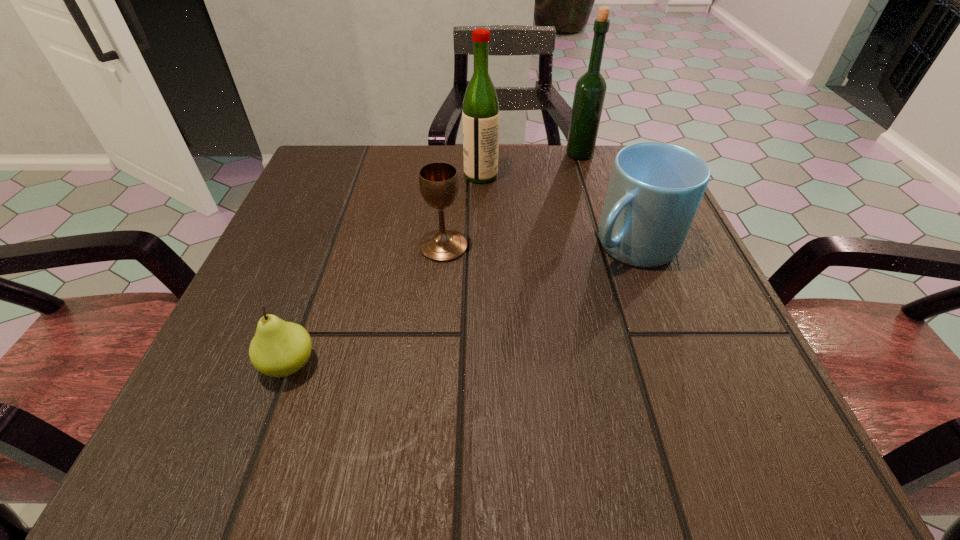
Locate an element on the screen. vacant space that is in between the fourth nearest object and the mug is located at coordinates click(556, 211).

At what (x,y) coordinates should I click in order to perform the action: click on free spot between the left liquor and the chalice. Please return your answer as a coordinate pair (x, y). The width and height of the screenshot is (960, 540). Looking at the image, I should click on (462, 211).

Where is `vacant region between the chalice and the right liquor`? vacant region between the chalice and the right liquor is located at coordinates (512, 200).

You are a GUI agent. You are given a task and a screenshot of the screen. Output one action in this format:
    pyautogui.click(x=<x>, y=<y>)
    Task: Click on the free space between the mug and the leftmost object
    This screenshot has height=540, width=960.
    Given the screenshot: What is the action you would take?
    pyautogui.click(x=461, y=305)

Locate an element on the screen. The width and height of the screenshot is (960, 540). vacant space in between the chalice and the nearer liquor is located at coordinates (462, 211).

Locate an element on the screen. The width and height of the screenshot is (960, 540). object that is the third closest to the mug is located at coordinates (438, 181).

You are a GUI agent. You are given a task and a screenshot of the screen. Output one action in this format:
    pyautogui.click(x=<x>, y=<y>)
    Task: Click on the object that is the third nearest to the chalice
    
    Given the screenshot: What is the action you would take?
    pyautogui.click(x=655, y=188)

You are a GUI agent. You are given a task and a screenshot of the screen. Output one action in this format:
    pyautogui.click(x=<x>, y=<y>)
    Task: Click on the free location that satisfies the following two spatial constraints: 1. on the label of the mug; 2. on the left side of the nearer liquor
    The image size is (960, 540).
    Given the screenshot: What is the action you would take?
    pyautogui.click(x=481, y=245)

Image resolution: width=960 pixels, height=540 pixels. Find the location of `free space that satisfies the following two spatial constraints: 1. on the label of the nearer liquor; 2. on the left side of the mug`. free space that satisfies the following two spatial constraints: 1. on the label of the nearer liquor; 2. on the left side of the mug is located at coordinates (481, 245).

What are the coordinates of `vacant space that satisfies the following two spatial constraints: 1. on the back side of the chalice; 2. on the right side of the mug` in the screenshot? It's located at 444,245.